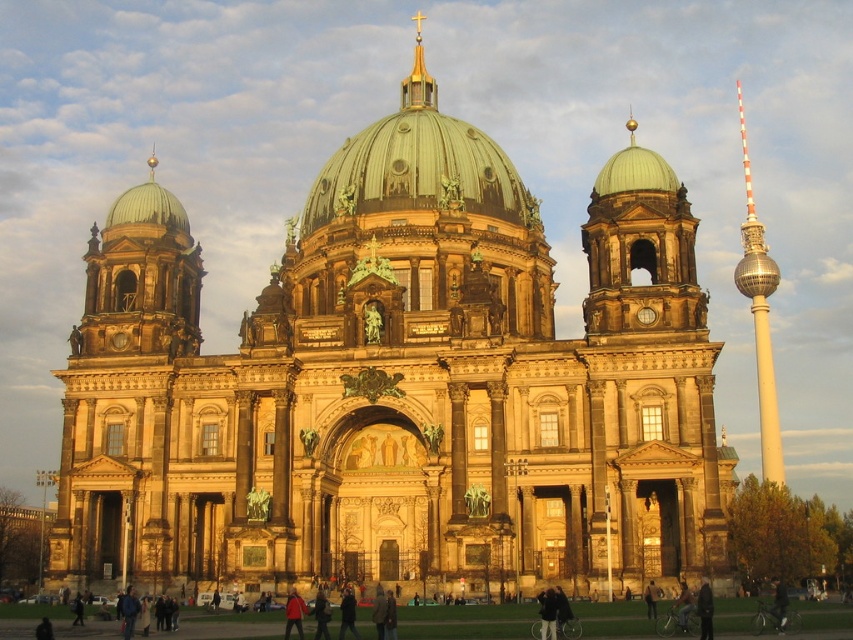
Question: Is green metallic dome at center thinner than silver metallic tower at right?

Choices:
 (A) no
 (B) yes

Answer: (A)

Question: Which point appears closest to the camera in this image?

Choices:
 (A) (519, 202)
 (B) (672, 252)
 (C) (413, 19)

Answer: (B)

Question: Does green metallic dome at center have a larger size compared to green copper dome at upper center?

Choices:
 (A) no
 (B) yes

Answer: (B)

Question: Which point appears farthest from the camera in this image?

Choices:
 (A) (776, 417)
 (B) (418, 20)
 (C) (421, 148)

Answer: (B)

Question: Which point is closer to the camera?

Choices:
 (A) (764, 476)
 (B) (424, 93)
 (C) (421, 40)

Answer: (B)

Question: Can you confirm if green metallic dome at center is thinner than green copper dome at upper center?

Choices:
 (A) no
 (B) yes

Answer: (A)